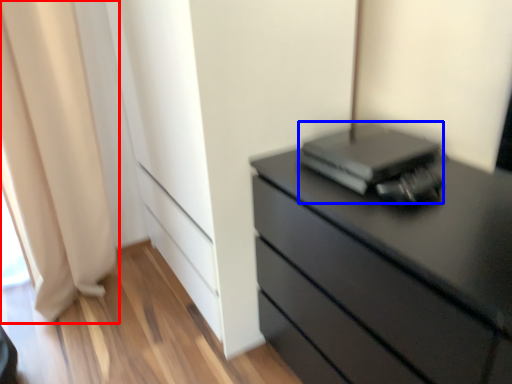
Question: Among these objects, which one is farthest to the camera, curtain (highlighted by a red box) or computer (highlighted by a blue box)?

Choices:
 (A) curtain
 (B) computer

Answer: (A)